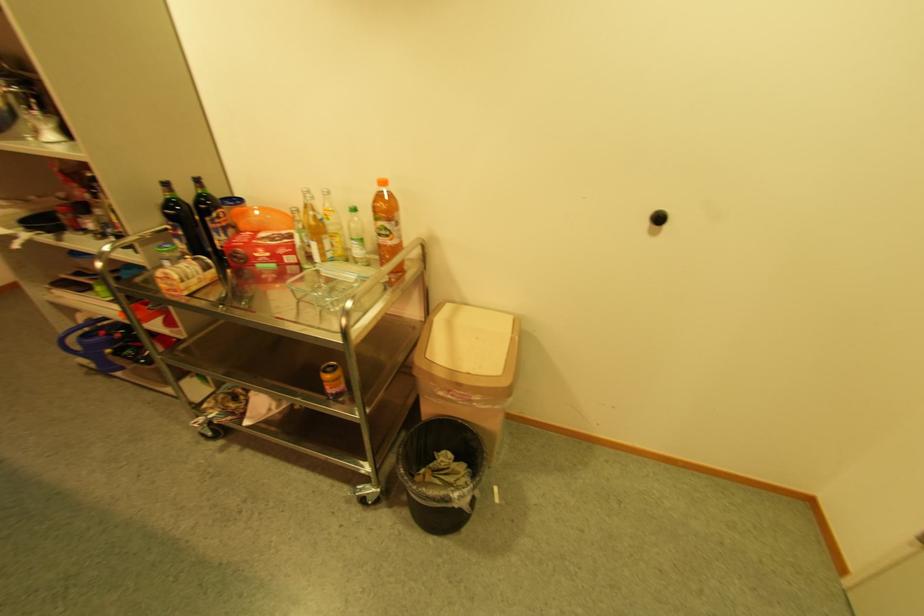
Find where to pull the black wall knob. Please return your answer as a coordinate pair (x, y).

(658, 217)